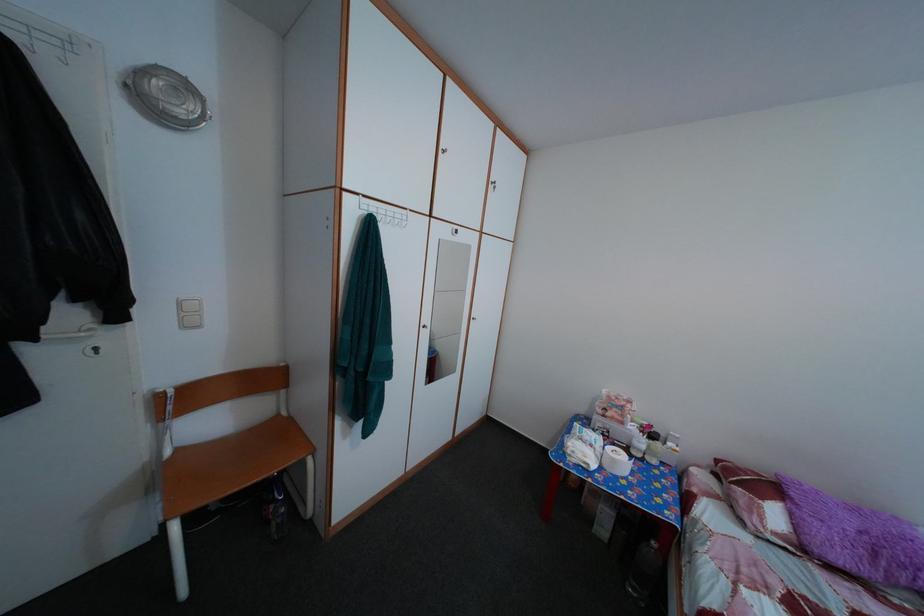
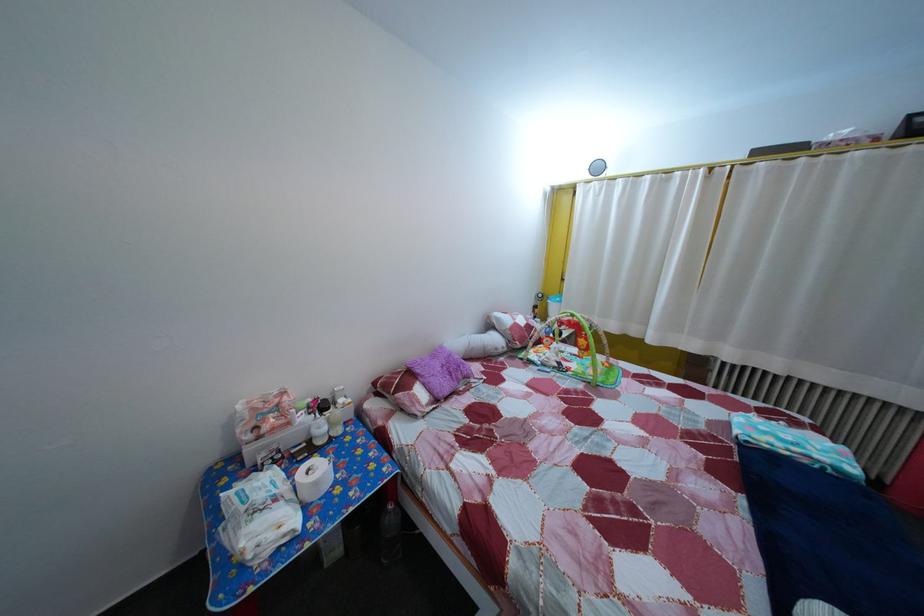
The point at (623, 468) is marked in the first image. Where is the corresponding point in the second image?

(325, 491)